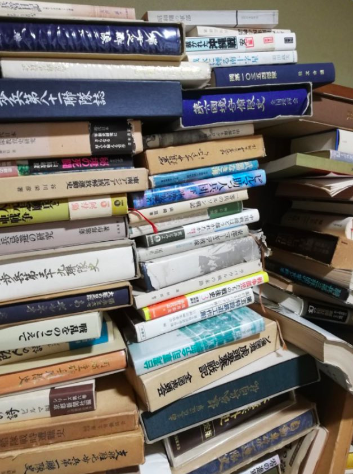
The height and width of the screenshot is (474, 353). What are the coordinates of `asian characters on spines` in the screenshot? It's located at (226, 356), (59, 332), (84, 274).